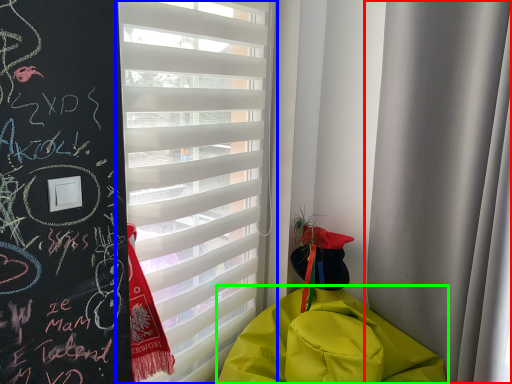
Question: Considering the real-world distances, which object is farthest from curtain (highlighted by a red box)? window blind (highlighted by a blue box) or blanket (highlighted by a green box)?

Choices:
 (A) window blind
 (B) blanket

Answer: (A)